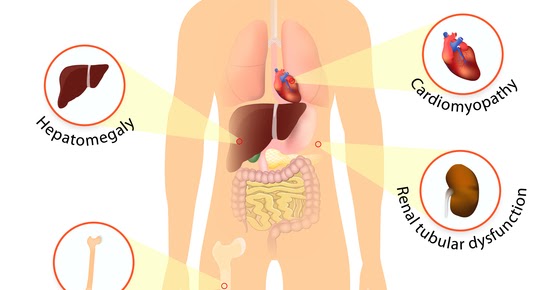
Image resolution: width=554 pixels, height=290 pixels. In order to click on light in this screenshot , I will do `click(194, 118)`.